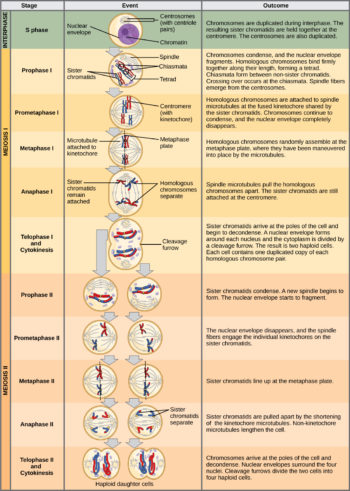
The height and width of the screenshot is (491, 350). I want to click on table, so click(x=80, y=7).